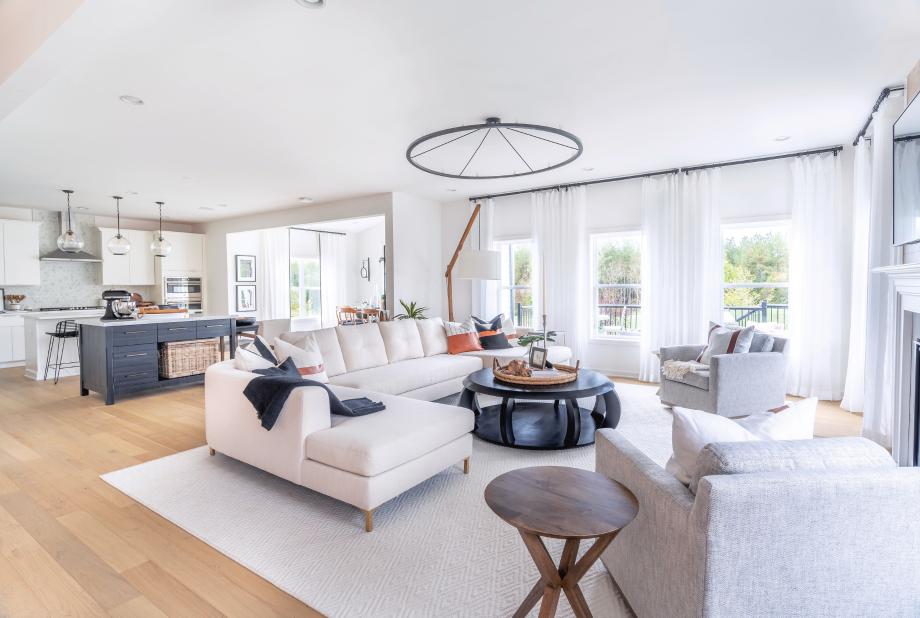
I want to click on stand mixer, so click(x=107, y=306).